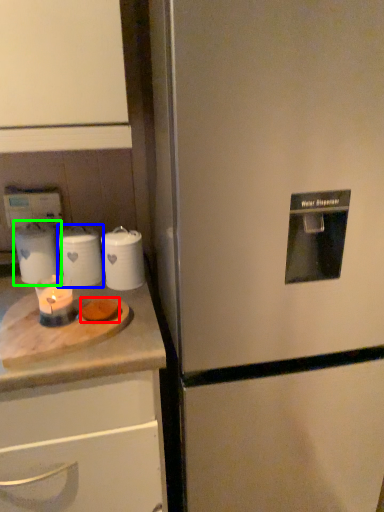
Question: Which object is positioned closest to food (highlighted by a red box)? Select from kitchen appliance (highlighted by a blue box) and appliance (highlighted by a green box).

Choices:
 (A) kitchen appliance
 (B) appliance

Answer: (A)